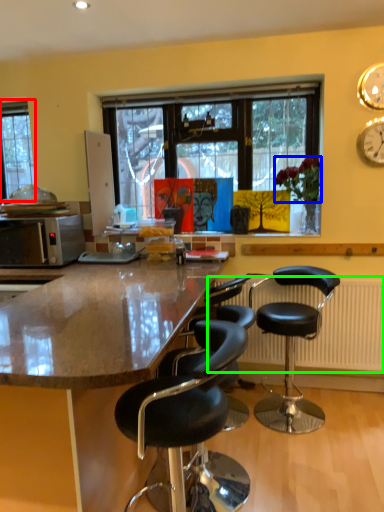
Question: Which object is the closest to the window (highlighted by a red box)? Choose among these: flower (highlighted by a blue box) or radiator (highlighted by a green box).

Choices:
 (A) flower
 (B) radiator

Answer: (A)